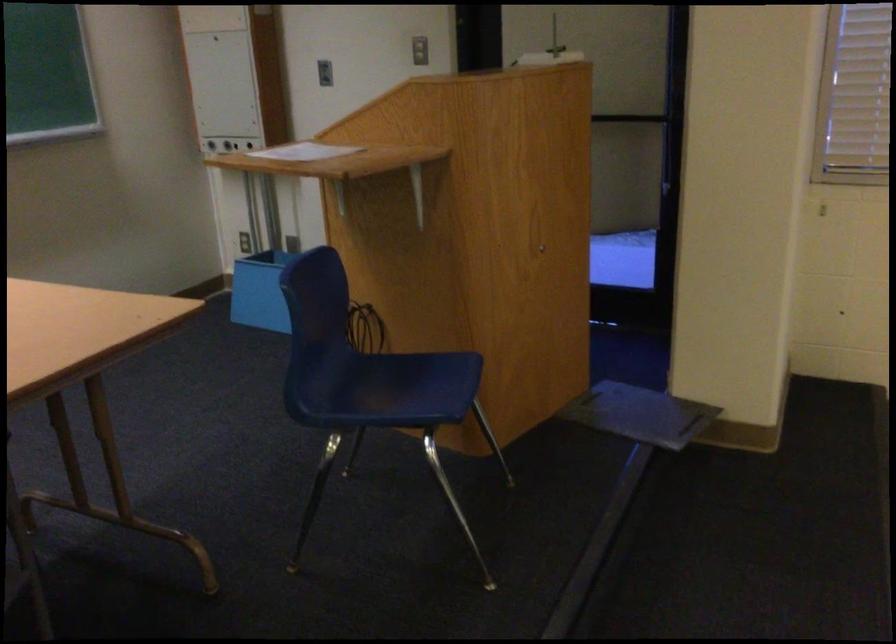
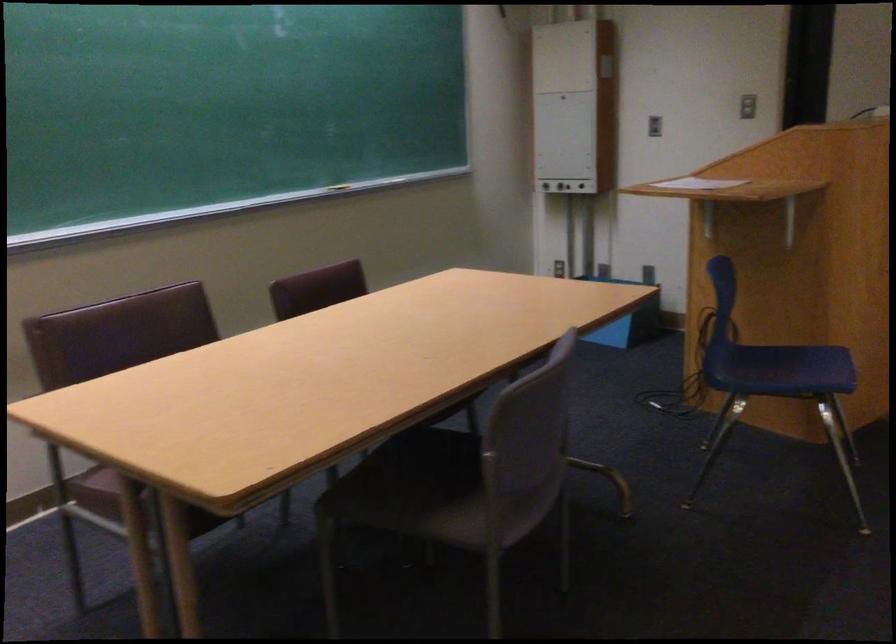
Locate, in the second image, the point that corresponds to [400,389] in the first image.

(782, 368)